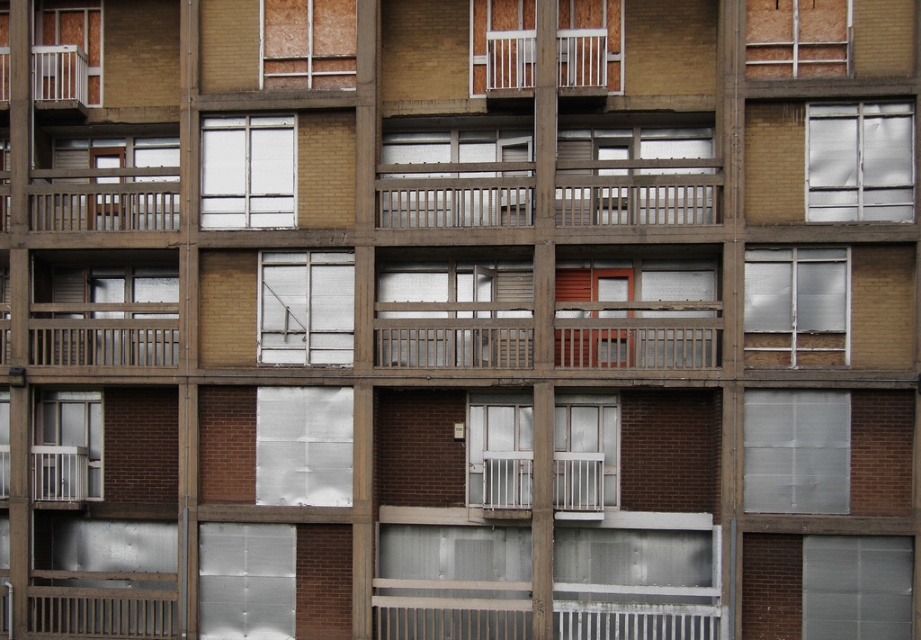
You are standing at the entrance of the building and want to locate the transparent plastic window at lower right. According to the coordinates provided, where should you look relative to the building?

The transparent plastic window at lower right is located at coordinates point (857,586), which corresponds to the lower right area of the building.

You are standing in front of the building and notice the wooden frame at upper right and the clear glass window at center. Which object is positioned more to the east side of the building?

The wooden frame at upper right is positioned to the right of the clear glass window at center, so it is more to the east side of the building.